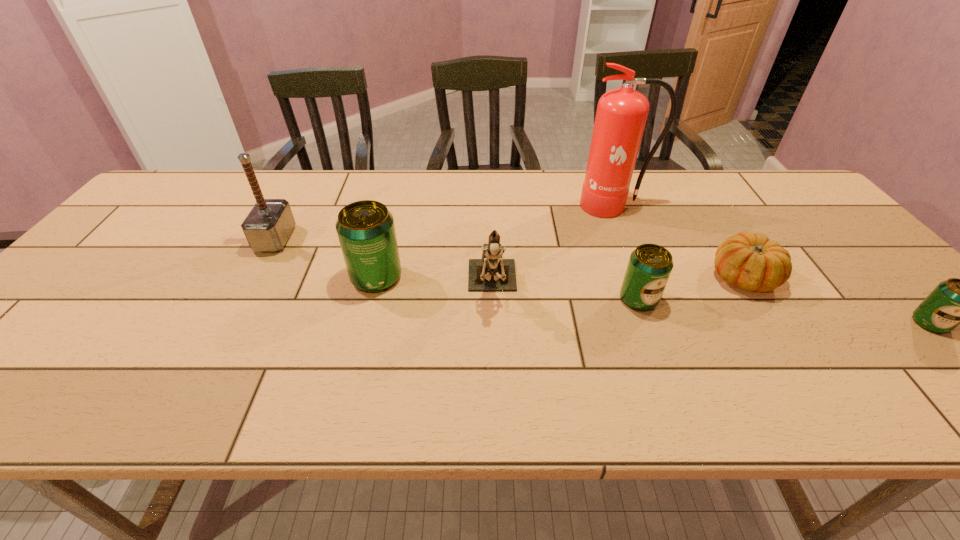
This screenshot has height=540, width=960. I want to click on gourd, so click(751, 262).

The image size is (960, 540). Identify the location of figurine. (492, 273).

The image size is (960, 540). I want to click on free space located 0.160m on the right of the sixth object from right to left, so click(x=466, y=278).

Where is `free point located on the back of the second tallest beer can`? This screenshot has height=540, width=960. free point located on the back of the second tallest beer can is located at coordinates (614, 234).

Locate an element on the screen. vacant space located 0.310m on the back of the rightmost object is located at coordinates (839, 230).

The image size is (960, 540). In order to click on free location located towards the nozzle of the fire extinguisher in this screenshot , I will do `click(628, 242)`.

Locate an element on the screen. free space located 0.210m on the left of the sixth nearest object is located at coordinates (183, 239).

Where is `vacant area situated 0.100m on the right of the sixth object from left to right`? This screenshot has height=540, width=960. vacant area situated 0.100m on the right of the sixth object from left to right is located at coordinates (815, 277).

The height and width of the screenshot is (540, 960). I want to click on vacant area located 0.150m on the front-facing side of the figurine, so click(x=494, y=368).

Where is `object positioned at the far edge`? This screenshot has width=960, height=540. object positioned at the far edge is located at coordinates (621, 115).